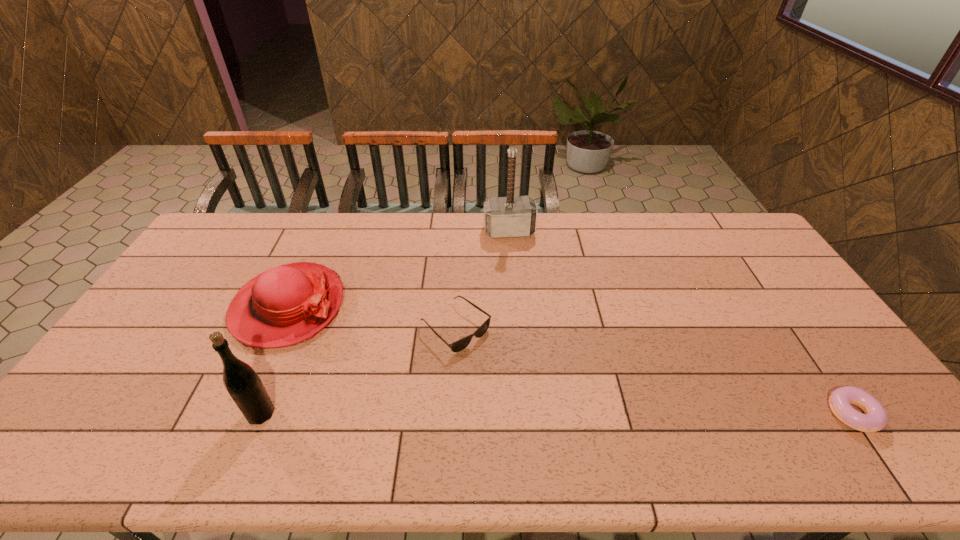
The image size is (960, 540). What are the coordinates of `vacant point located at the front of the third shortest object with a bow` in the screenshot? It's located at (410, 377).

You are a GUI agent. You are given a task and a screenshot of the screen. Output one action in this format:
    pyautogui.click(x=<x>, y=<y>)
    Task: Click on the vacant space located 0.330m at the front of the third shortest object with a bow
    Image resolution: width=960 pixels, height=540 pixels.
    Given the screenshot: What is the action you would take?
    pyautogui.click(x=416, y=381)

Find the location of a particular element. The image size is (960, 540). vacant space located 0.160m at the front of the third shortest object with a bow is located at coordinates (368, 353).

The height and width of the screenshot is (540, 960). I want to click on free spot located 0.060m on the lenses of the sunglasses, so click(494, 361).

The height and width of the screenshot is (540, 960). I want to click on vacant space located 0.140m on the lenses of the sunglasses, so click(516, 379).

I want to click on vacant space situated 0.060m on the lenses of the sunglasses, so click(x=494, y=361).

You are a GUI agent. You are given a task and a screenshot of the screen. Output one action in this format:
    pyautogui.click(x=<x>, y=<y>)
    Task: Click on the object that is at the far edge
    
    Given the screenshot: What is the action you would take?
    pyautogui.click(x=510, y=216)

I want to click on beer bottle that is at the near edge, so click(245, 387).

The image size is (960, 540). What are the coordinates of `doughnut at the near edge` in the screenshot? It's located at (875, 418).

Locate an element on the screen. object positioned at the right edge is located at coordinates (875, 418).